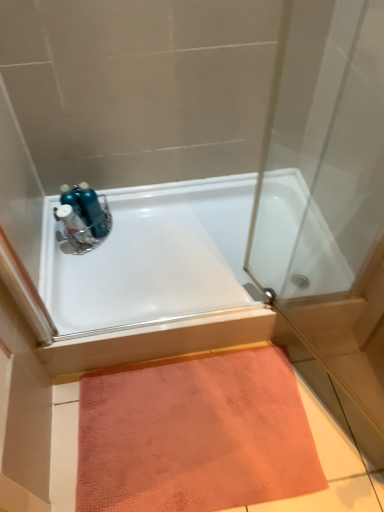
I want to click on vacant area situated to the left side of metallic blue sink at upper left, so click(x=61, y=251).